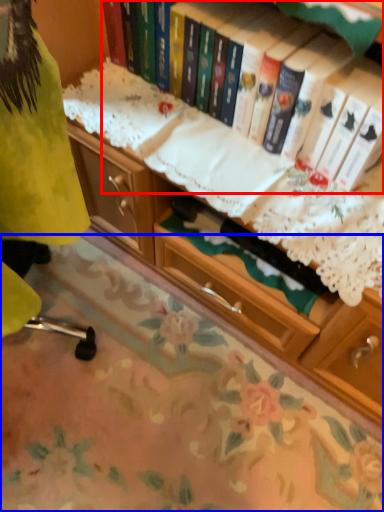
Question: Which object appears closest to the camera in this image, book (highlighted by a red box) or tablecloth (highlighted by a blue box)?

Choices:
 (A) book
 (B) tablecloth

Answer: (A)